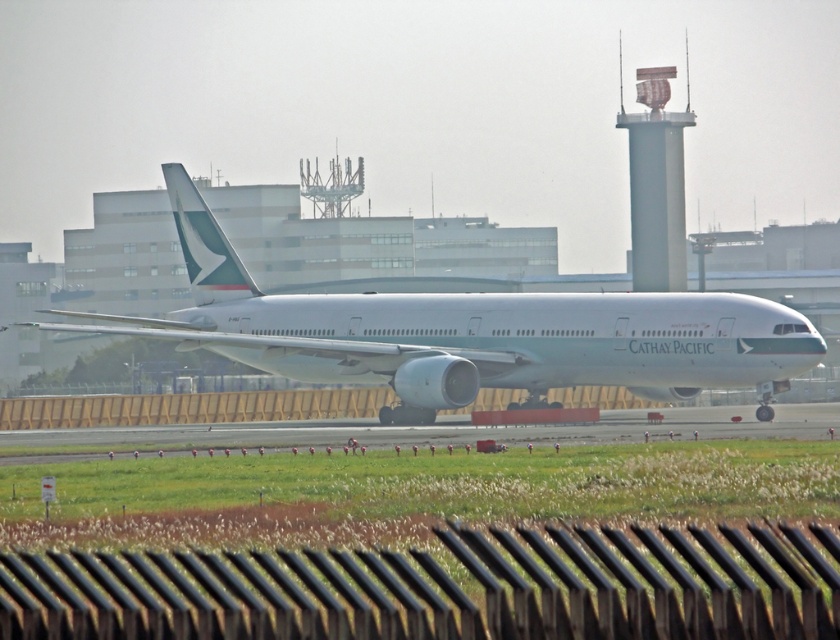
Question: Can you confirm if white glossy airplane at center is thinner than smooth gray control tower at upper right?

Choices:
 (A) no
 (B) yes

Answer: (A)

Question: Is white glossy airplane at center to the left of smooth gray control tower at upper right from the viewer's perspective?

Choices:
 (A) no
 (B) yes

Answer: (B)

Question: Which point appears farthest from the camera in this image?

Choices:
 (A) (804, 348)
 (B) (673, 154)

Answer: (B)

Question: Which of the following is the farthest from the observer?

Choices:
 (A) smooth gray control tower at upper right
 (B) white glossy airplane at center

Answer: (A)

Question: Observing the image, what is the correct spatial positioning of white glossy airplane at center in reference to smooth gray control tower at upper right?

Choices:
 (A) right
 (B) left

Answer: (B)